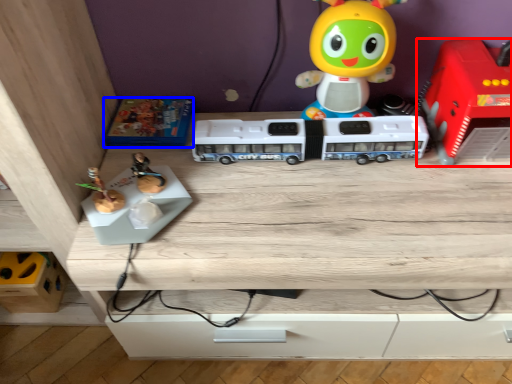
Question: Which of the following is the farthest to the observer, toy (highlighted by a red box) or toy (highlighted by a blue box)?

Choices:
 (A) toy
 (B) toy

Answer: (B)